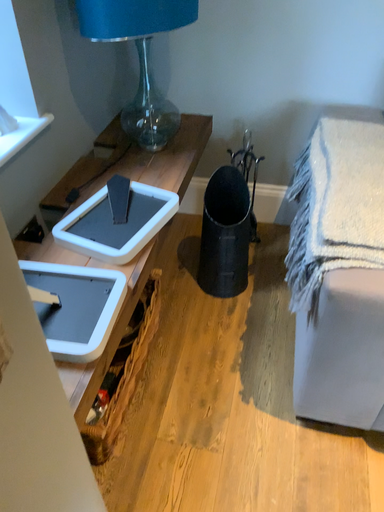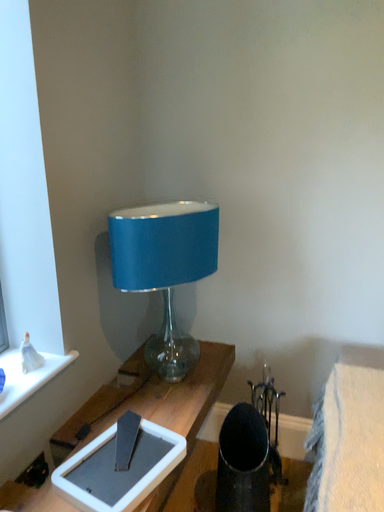
Question: How did the camera likely rotate when shooting the video?

Choices:
 (A) rotated downward
 (B) rotated upward

Answer: (B)